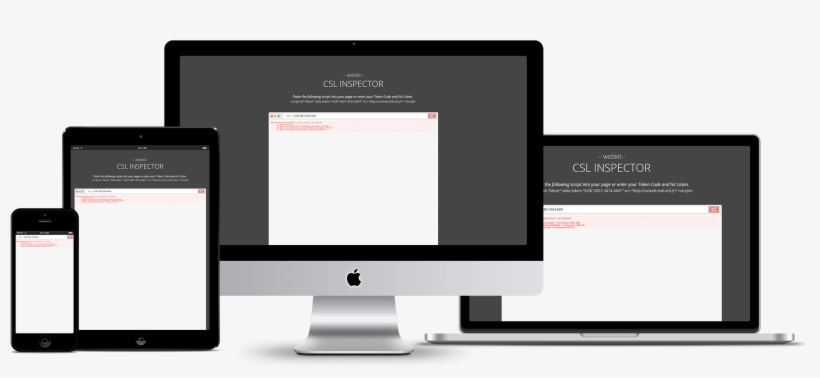
Find the location of a particular element. This screenshot has width=820, height=378. phone is located at coordinates (37, 248).